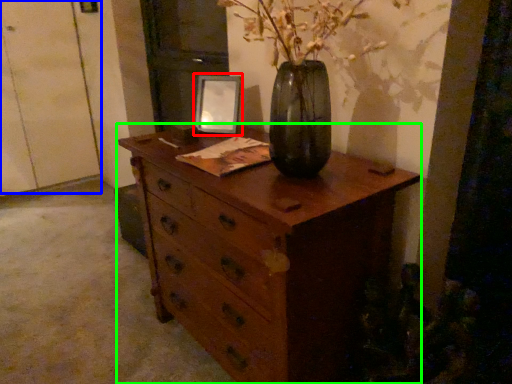
Question: Based on their relative distances, which object is nearer to picture frame (highlighted by a red box)? Choose from door (highlighted by a blue box) and chest of drawers (highlighted by a green box).

Choices:
 (A) door
 (B) chest of drawers

Answer: (B)